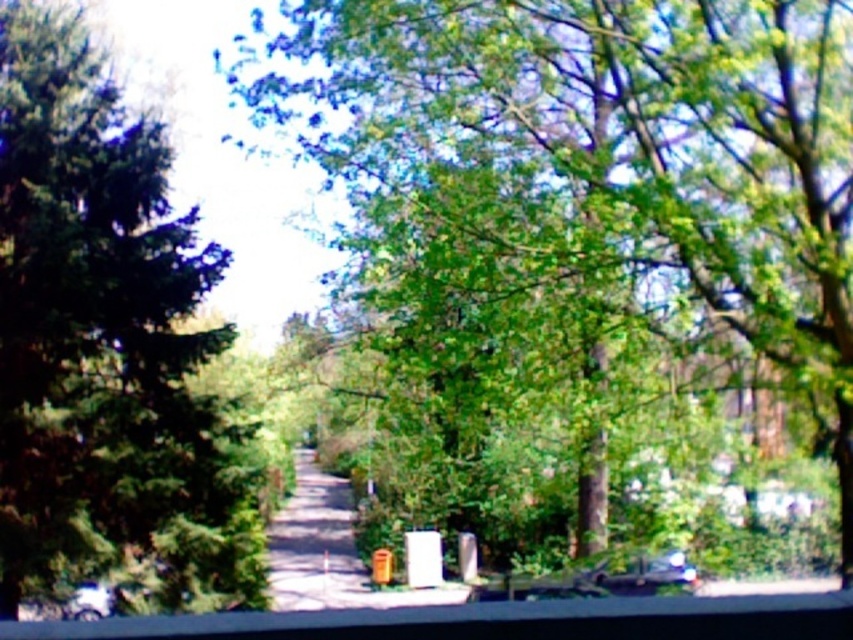
Question: Does green leafy tree at center have a larger size compared to green matte tree at left?

Choices:
 (A) yes
 (B) no

Answer: (A)

Question: Which is nearer to the green leafy tree at center?

Choices:
 (A) shiny metallic car at lower right
 (B) green matte tree at left

Answer: (A)

Question: Which point is farther to the camera?

Choices:
 (A) (602, 570)
 (B) (74, 385)
 (C) (830, 342)

Answer: (A)

Question: In this image, where is green matte tree at left located relative to shiny metallic car at lower right?

Choices:
 (A) above
 (B) below

Answer: (A)

Question: Is green leafy tree at center closer to camera compared to shiny metallic car at lower right?

Choices:
 (A) no
 (B) yes

Answer: (B)

Question: Which point is farther from the camera taking this photo?

Choices:
 (A) [682, 557]
 (B) [50, 579]

Answer: (B)